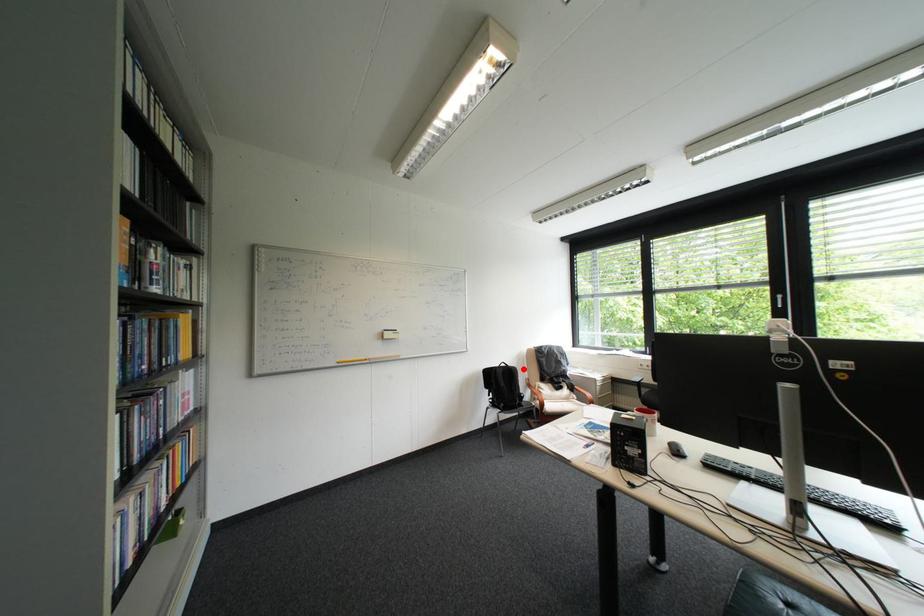
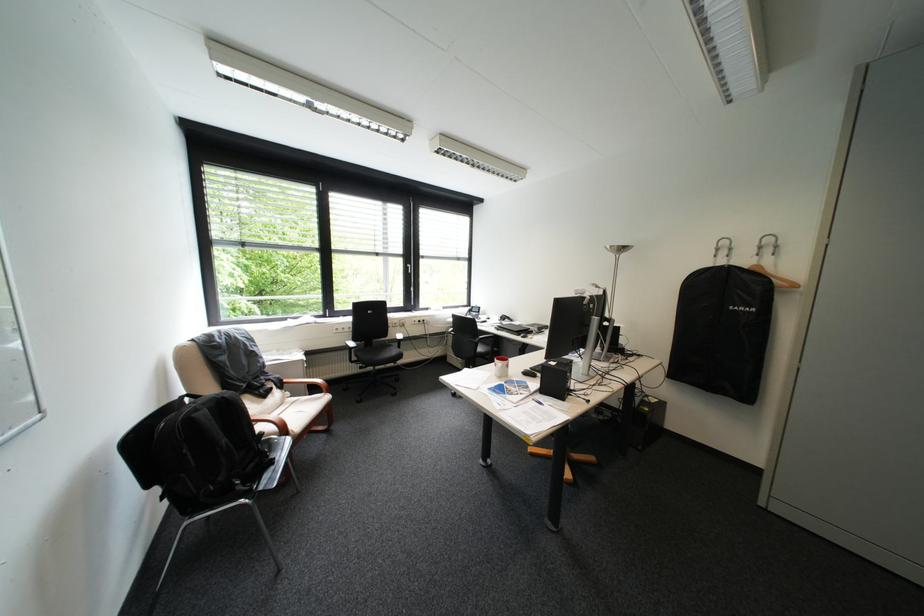
Question: I am providing you with two images of the same scene from different viewpoints. Given a red point in image1, look at the same physical point in image2. Is it:

Choices:
 (A) Closer to the viewpoint
 (B) Farther from the viewpoint

Answer: (A)